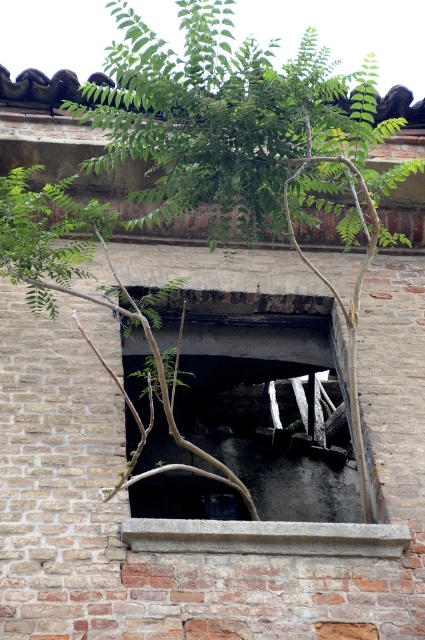
Which is above, charcoal ash hole at center or gray concrete ledge at center?

charcoal ash hole at center is above.

Between charcoal ash hole at center and gray concrete ledge at center, which one is positioned lower?

gray concrete ledge at center is lower down.

Is point (187, 452) more distant than point (350, 536)?

Yes, it is behind point (350, 536).

Locate an element on the screen. charcoal ash hole at center is located at coordinates (257, 404).